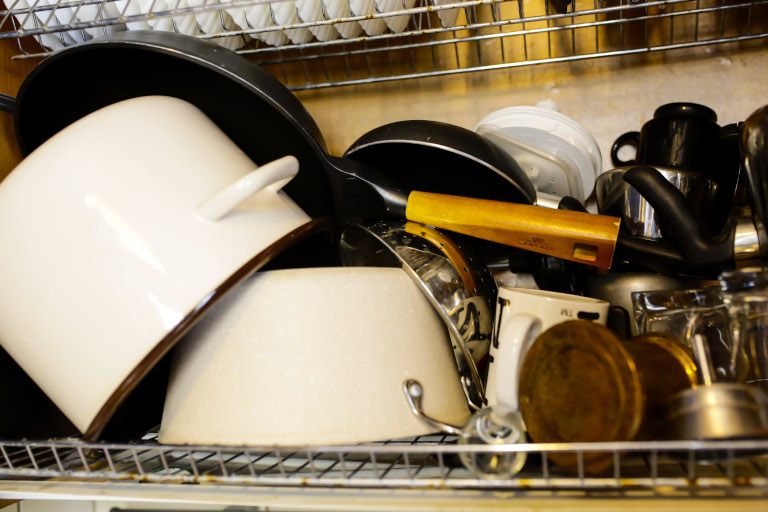
I want to click on mug, so click(521, 310).